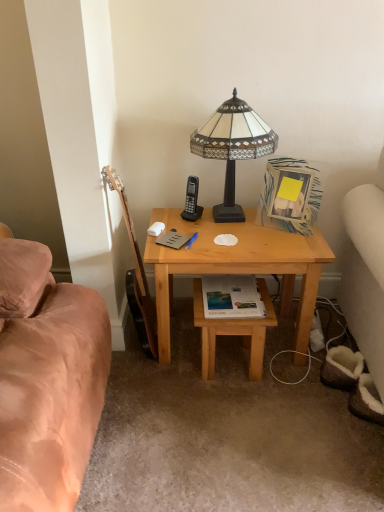
What are the coordinates of `vacant area on top of light brown wooden stool at lower center (from a real-world perspective)` in the screenshot? It's located at (235, 300).